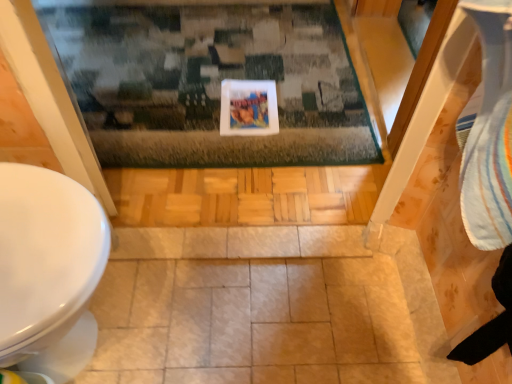
Image resolution: width=512 pixels, height=384 pixels. I want to click on vacant area on top of textured green rug at center (from a real-world perspective), so click(197, 64).